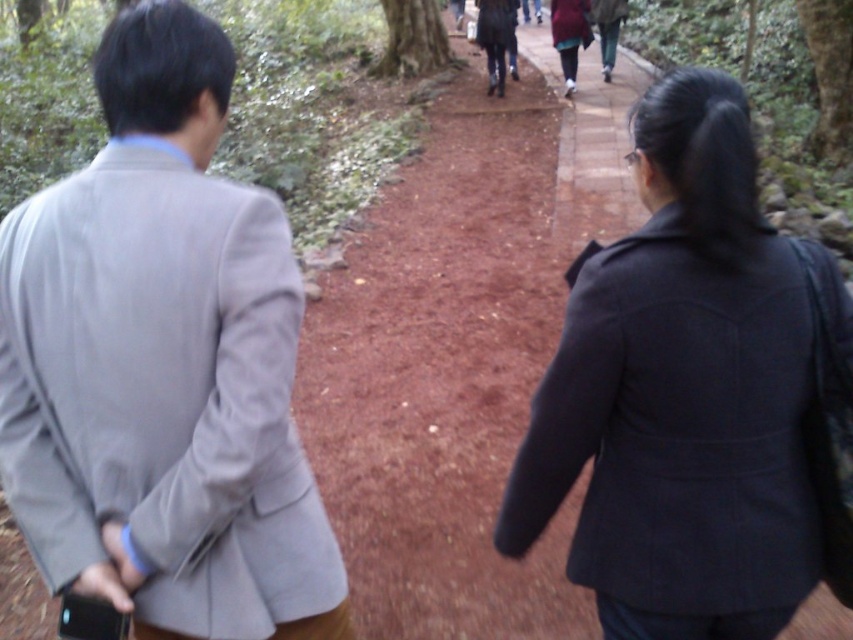
Question: Among these points, which one is nearest to the camera?

Choices:
 (A) (554, 29)
 (B) (593, 317)

Answer: (B)

Question: Which object is closer to the camera taking this photo?

Choices:
 (A) maroon fabric coat at center
 (B) matte black coat at center
 (C) dark red fabric coat at center
 (D) light gray suit at left

Answer: (D)

Question: Among these points, which one is nearest to the camera?

Choices:
 (A) (573, 77)
 (B) (593, 6)
 (C) (207, 516)

Answer: (C)

Question: Can you confirm if light gray suit at left is positioned above matte black coat at center?

Choices:
 (A) yes
 (B) no

Answer: (B)

Question: Does dark red fabric coat at center have a lesser width compared to maroon fabric coat at center?

Choices:
 (A) no
 (B) yes

Answer: (A)

Question: Where is matte black coat at center located in relation to maroon fabric coat at center in the image?

Choices:
 (A) left
 (B) right

Answer: (A)